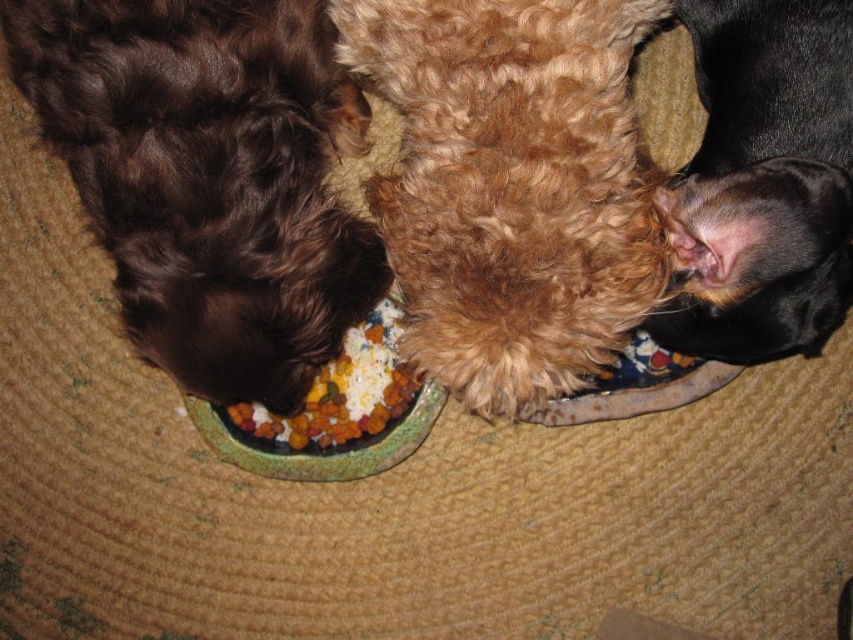
Question: Is shiny brown fur at left positioned in front of black fur at upper right?

Choices:
 (A) no
 (B) yes

Answer: (A)

Question: Which point is farther to the camera?

Choices:
 (A) (842, 70)
 (B) (409, 403)
 (C) (328, 324)

Answer: (B)

Question: Can you confirm if shiny brown fur at left is bigger than black fur at upper right?

Choices:
 (A) yes
 (B) no

Answer: (A)

Question: Is shiny brown fur at left bigger than multicolored kibble at center?

Choices:
 (A) yes
 (B) no

Answer: (A)

Question: Which object appears farthest from the camera in this image?

Choices:
 (A) black fur at upper right
 (B) shiny brown fur at left
 (C) multicolored kibble at center

Answer: (C)

Question: Which of the following is the closest to the observer?

Choices:
 (A) (347, 380)
 (B) (85, 35)

Answer: (B)